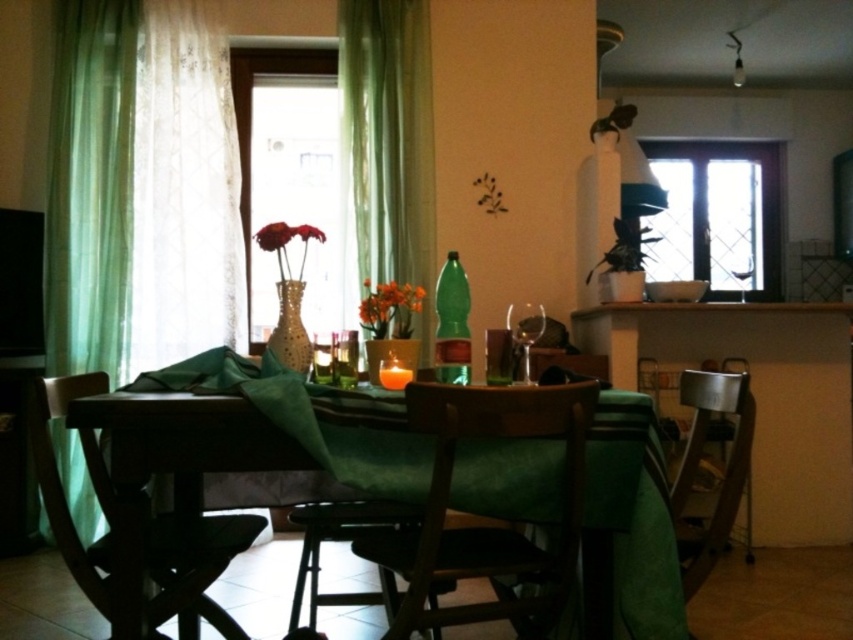
Question: Is transparent glass window at upper right above metallic silver chair at right?

Choices:
 (A) no
 (B) yes

Answer: (B)

Question: Which point appears closest to the camera in this image?

Choices:
 (A) (685, 384)
 (B) (502, 541)
 (C) (194, 600)
 (D) (195, 264)

Answer: (B)

Question: Does green sheer curtain at left appear over wooden chair at center?

Choices:
 (A) no
 (B) yes

Answer: (B)

Question: Which of the following is the closest to the observer?

Choices:
 (A) (523, 561)
 (B) (192, 228)
 (C) (693, 216)
 (D) (248, 81)

Answer: (A)

Question: In this image, where is green sheer curtain at left located relative to metallic silver chair at right?

Choices:
 (A) below
 (B) above

Answer: (B)

Question: Among these points, which one is nearest to the camera?

Choices:
 (A) (276, 70)
 (B) (357, 112)
 (C) (68, 349)
 (D) (190, 595)

Answer: (D)